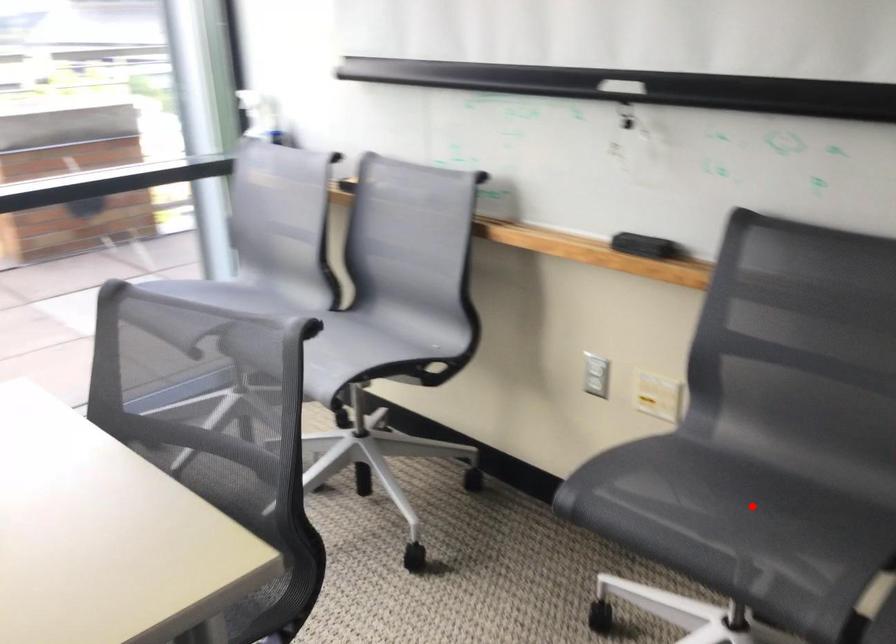
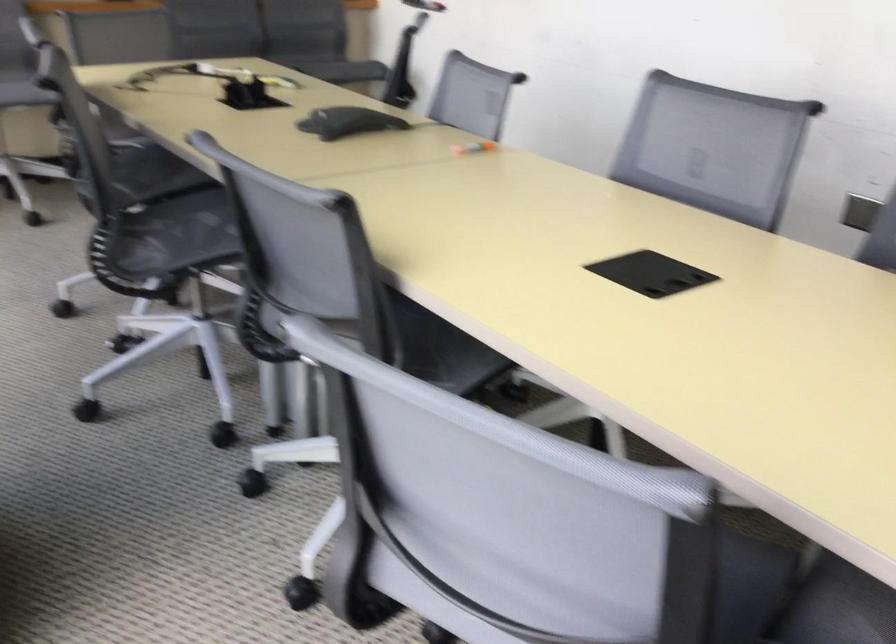
Question: I am providing you with two images of the same scene from different viewpoints. A red point is marked on the first image. At the location where the point appears in image 1, is it still visible in image 2?

Choices:
 (A) Yes
 (B) No

Answer: (B)